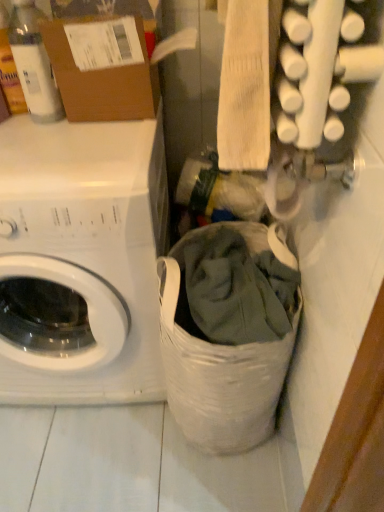
The image size is (384, 512). I want to click on free space in front of brown cardboard box at upper left, so click(x=91, y=153).